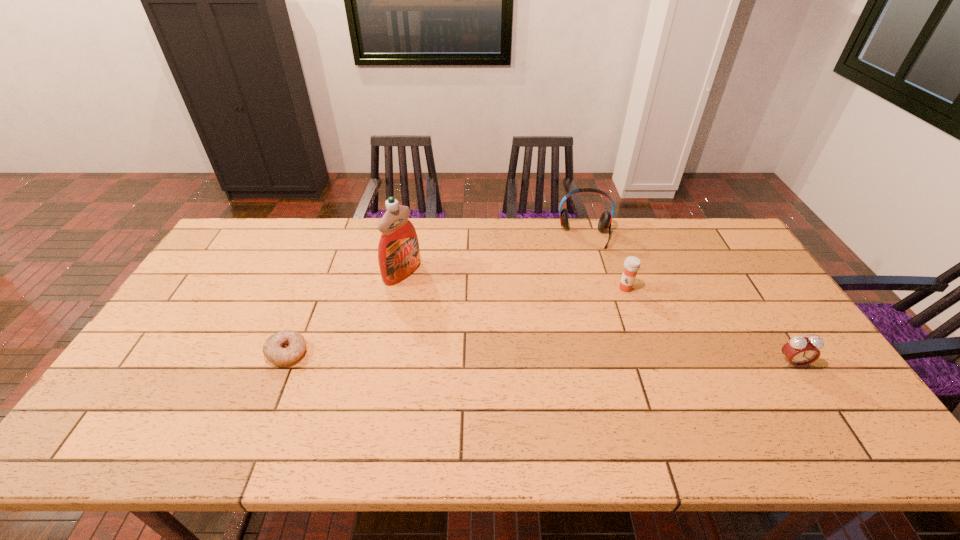
Where is `free region that satisfies the following two spatial constraints: 1. on the back side of the fourth shortest object; 2. on the left side of the tallest object`? This screenshot has width=960, height=540. free region that satisfies the following two spatial constraints: 1. on the back side of the fourth shortest object; 2. on the left side of the tallest object is located at coordinates (410, 236).